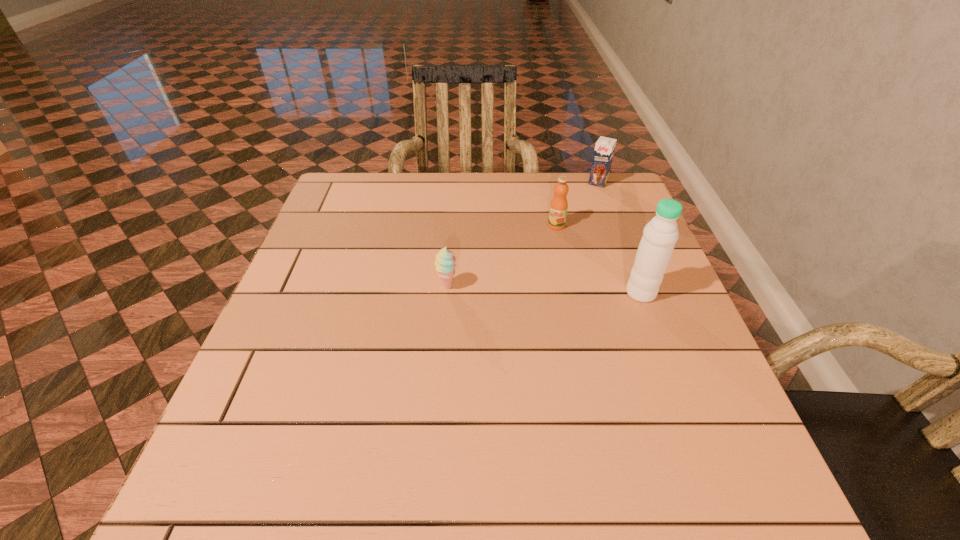
Find the location of a particular element. The width and height of the screenshot is (960, 540). vacant space located on the front label of the second object from left to right is located at coordinates (543, 245).

This screenshot has width=960, height=540. Identify the location of free location located on the front label of the farthest object. (588, 199).

Identify the location of free space located on the front label of the farthest object. This screenshot has height=540, width=960. (585, 204).

This screenshot has width=960, height=540. Find the location of `free region located on the front label of the farthest object`. free region located on the front label of the farthest object is located at coordinates (554, 254).

This screenshot has width=960, height=540. I want to click on object that is at the far edge, so click(x=604, y=149).

At what (x,y) coordinates should I click in order to perform the action: click on water bottle that is at the right edge. Please return your answer as a coordinate pair (x, y). Looking at the image, I should click on [659, 237].

Identify the location of chocolate milk that is positioned at the right edge. This screenshot has width=960, height=540. (604, 149).

You are a GUI agent. You are given a task and a screenshot of the screen. Output one action in this format:
    pyautogui.click(x=<x>, y=<y>)
    Task: Click on the object located in the far right corner section of the desktop
    This screenshot has width=960, height=540.
    Given the screenshot: What is the action you would take?
    pyautogui.click(x=604, y=149)

In the image, there is a desktop. What are the coordinates of `vacant space at the far edge` in the screenshot? It's located at (393, 207).

The width and height of the screenshot is (960, 540). Identify the location of vacant space at the near edge of the desktop. (389, 429).